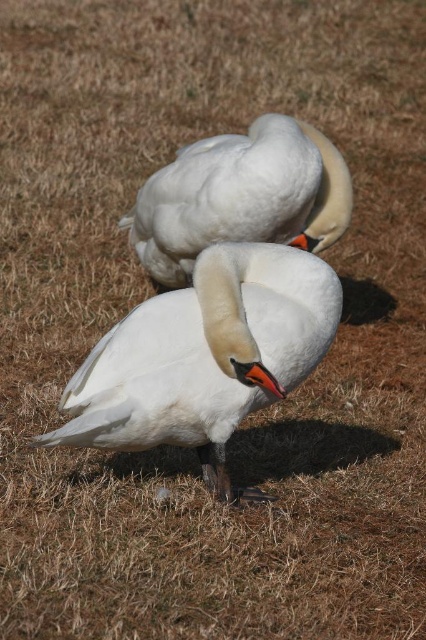
Between white glossy swan at center and white matte swan at center, which one is positioned higher?

Positioned higher is white matte swan at center.

Is white glossy swan at center below white matte swan at center?

Yes, white glossy swan at center is below white matte swan at center.

Which is in front, point (137, 442) or point (339, 173)?

Point (137, 442) is more forward.

Locate an element on the screen. The height and width of the screenshot is (640, 426). white glossy swan at center is located at coordinates (204, 355).